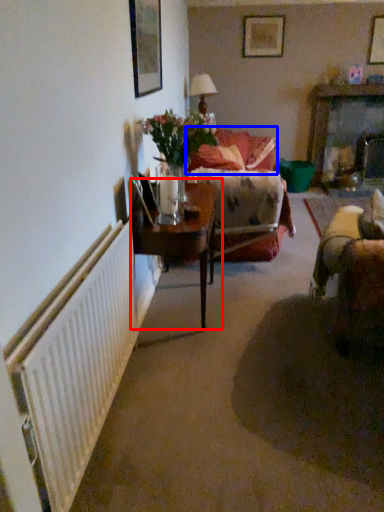
Question: Which point is further to the camera, table (highlighted by a red box) or couch (highlighted by a blue box)?

Choices:
 (A) table
 (B) couch

Answer: (B)